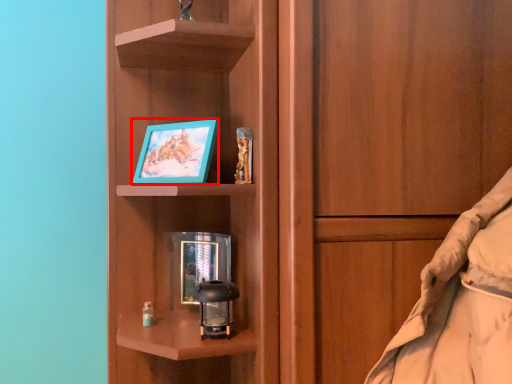
Question: From the image's perspective, considering the relative positions of picture frame (annotated by the red box) and picture frame in the image provided, where is picture frame (annotated by the red box) located with respect to the staircase?

Choices:
 (A) above
 (B) below

Answer: (A)